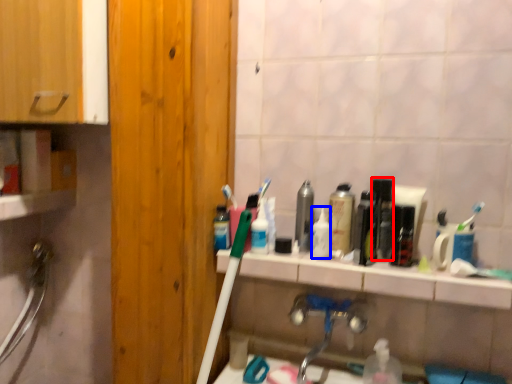
Question: Which object is further to the camera taking this photo, mouthwash (highlighted by a red box) or toiletry (highlighted by a blue box)?

Choices:
 (A) mouthwash
 (B) toiletry

Answer: (B)